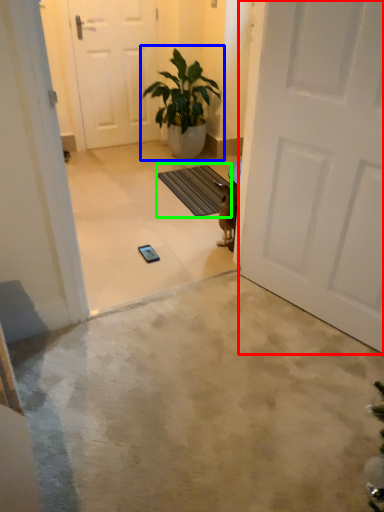
Question: Based on their relative distances, which object is farther from door (highlighted by a red box)? Choose from houseplant (highlighted by a blue box) and doormat (highlighted by a green box).

Choices:
 (A) houseplant
 (B) doormat

Answer: (A)